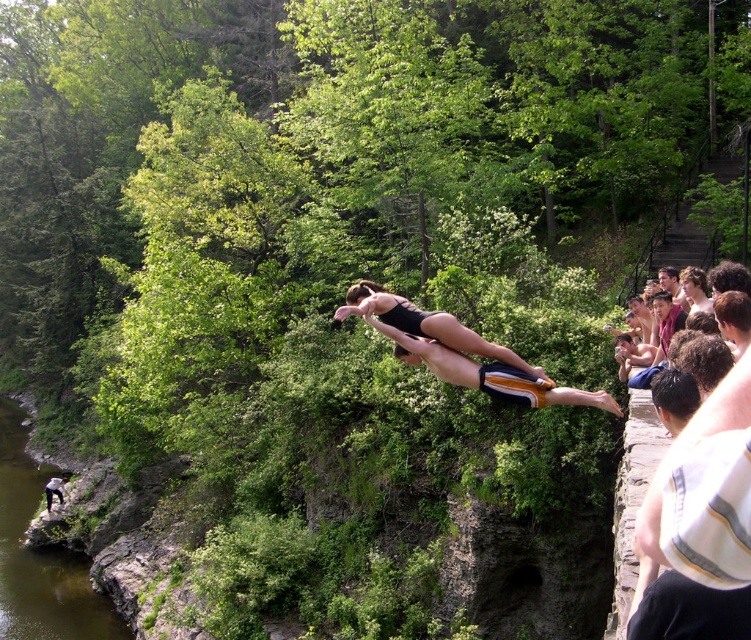
Question: Is white striped shirt at right positioned at the back of matte black swim trunks at center?

Choices:
 (A) yes
 (B) no

Answer: (B)

Question: Is white striped shirt at right to the right of matte black swim trunks at center from the viewer's perspective?

Choices:
 (A) no
 (B) yes

Answer: (B)

Question: Which point appears farthest from the camera in this image?

Choices:
 (A) (740, 480)
 (B) (50, 632)

Answer: (B)

Question: Which object is positioned closest to the matte black swim trunks at center?

Choices:
 (A) green smooth water at lower left
 (B) white striped shirt at right

Answer: (A)

Question: Which object is the farthest from the green smooth water at lower left?

Choices:
 (A) white striped shirt at right
 (B) matte black swim trunks at center

Answer: (A)

Question: Does green smooth water at lower left have a lesser width compared to matte black swim trunks at center?

Choices:
 (A) yes
 (B) no

Answer: (B)